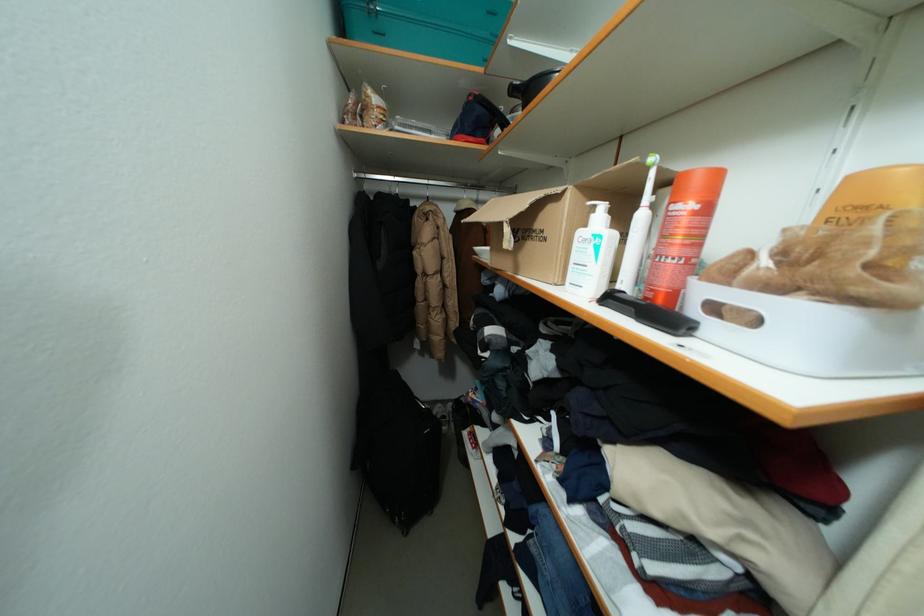
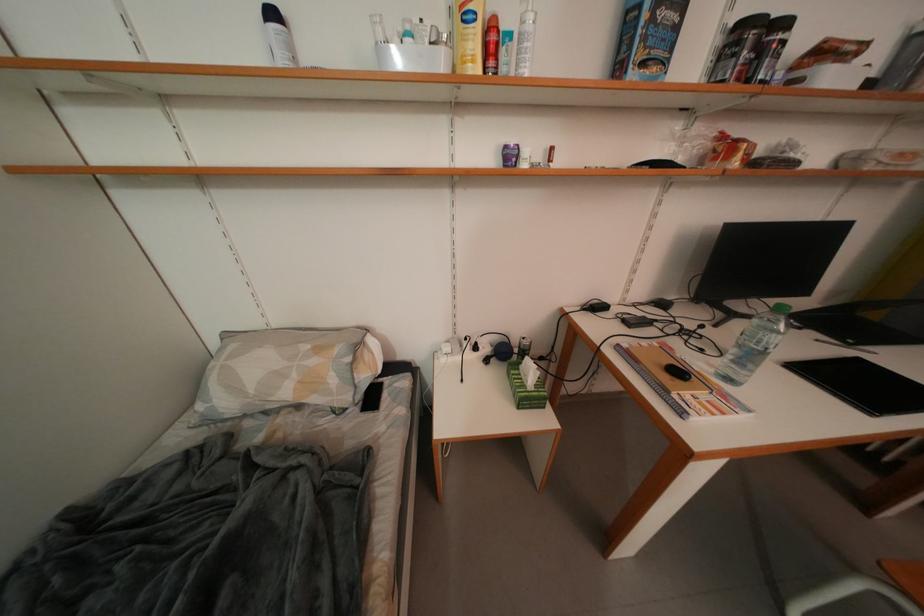
Which direction would the cameraman need to move to produce the second image?

The cameraman moved toward right, forward.